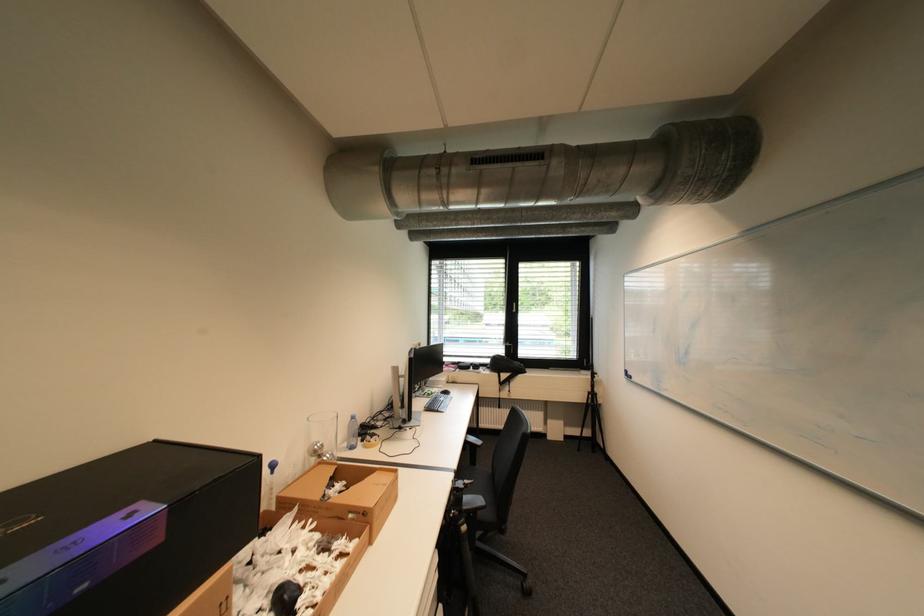
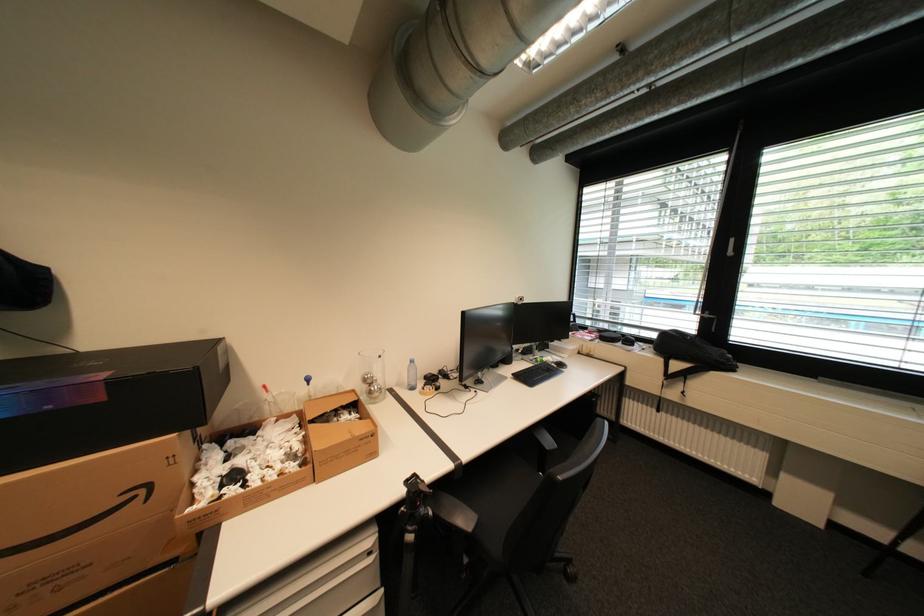
Where in the second image is the point corresponding to [326,447] from the first image?

(377, 378)